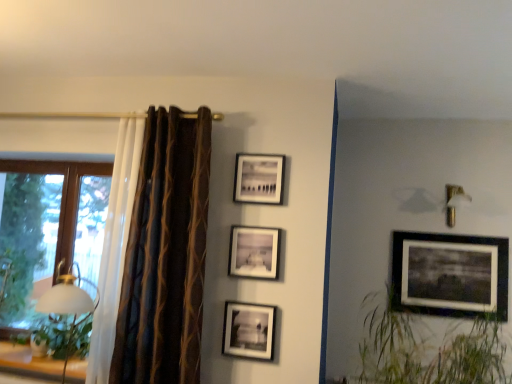
Question: Is green leafy plant at left to the right of matte black picture frame at center, arranged as the 3th picture frame when viewed from the right, from the viewer's perspective?

Choices:
 (A) yes
 (B) no

Answer: (B)

Question: Is the depth of green leafy plant at left less than that of matte black picture frame at center, which is counted as the 2th picture frame, starting from the front?

Choices:
 (A) no
 (B) yes

Answer: (A)

Question: Is there a large distance between green leafy plant at left and matte black picture frame at center, arranged as the 3th picture frame when viewed from the right?

Choices:
 (A) no
 (B) yes

Answer: (B)

Question: Can we say green leafy plant at left lies outside matte black picture frame at center, the second picture frame in the left-to-right sequence?

Choices:
 (A) yes
 (B) no

Answer: (A)

Question: Does green leafy plant at left appear on the left side of matte black picture frame at center, arranged as the third picture frame when viewed from the back?

Choices:
 (A) yes
 (B) no

Answer: (A)

Question: Is point (242, 317) closer or farther from the camera than point (82, 304)?

Choices:
 (A) farther
 (B) closer

Answer: (A)

Question: Considering the positions of matte black picture frame at center, the fourth picture frame in the back-to-front sequence, and white glossy table lamp at left in the image, is matte black picture frame at center, the fourth picture frame in the back-to-front sequence, wider or thinner than white glossy table lamp at left?

Choices:
 (A) thin
 (B) wide

Answer: (A)

Question: Would you say matte black picture frame at center, the fourth picture frame in the back-to-front sequence, is to the left or to the right of white glossy table lamp at left in the picture?

Choices:
 (A) left
 (B) right

Answer: (B)

Question: Looking at the image, does matte black picture frame at center, which appears as the first picture frame when viewed from the left, seem bigger or smaller compared to white glossy table lamp at left?

Choices:
 (A) big
 (B) small

Answer: (B)

Question: Considering their positions, is gold metallic wall sconce at upper right located in front of or behind wooden frame window at left?

Choices:
 (A) behind
 (B) front

Answer: (B)

Question: In terms of width, does gold metallic wall sconce at upper right look wider or thinner when compared to wooden frame window at left?

Choices:
 (A) thin
 (B) wide

Answer: (B)

Question: From their relative heights in the image, would you say gold metallic wall sconce at upper right is taller or shorter than wooden frame window at left?

Choices:
 (A) tall
 (B) short

Answer: (B)

Question: Would you say gold metallic wall sconce at upper right is to the left or to the right of wooden frame window at left in the picture?

Choices:
 (A) left
 (B) right

Answer: (B)

Question: In terms of height, does matte black picture frame at center, which is counted as the 2th picture frame, starting from the front, look taller or shorter compared to brown striped curtain at left?

Choices:
 (A) short
 (B) tall

Answer: (A)

Question: Looking at their shapes, would you say matte black picture frame at center, which is counted as the 2th picture frame, starting from the front, is wider or thinner than brown striped curtain at left?

Choices:
 (A) wide
 (B) thin

Answer: (B)